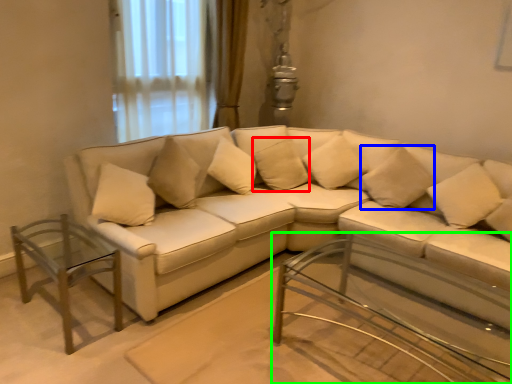
Question: Considering the real-world distances, which object is closest to pillow (highlighted by a red box)? pillow (highlighted by a blue box) or table (highlighted by a green box).

Choices:
 (A) pillow
 (B) table

Answer: (A)